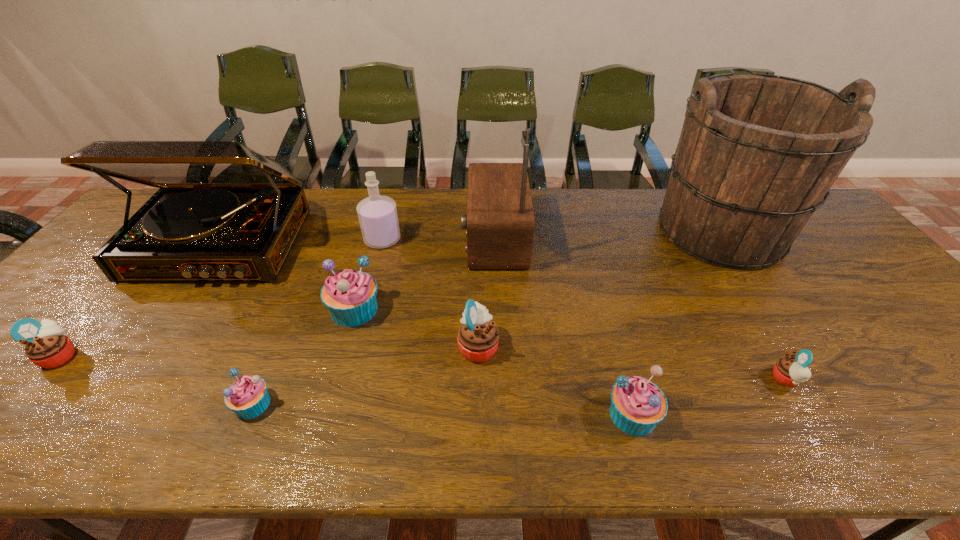
This screenshot has height=540, width=960. What are the coordinates of `the second smallest pink muffin` in the screenshot? It's located at pos(47,345).

The image size is (960, 540). Identify the location of the fifth muffin from left to right. (637, 405).

Where is `the third object from right to left`? the third object from right to left is located at coordinates click(x=637, y=405).

In order to click on the rightmost muffin in this screenshot , I will do `click(790, 371)`.

At what (x,y) coordinates should I click in order to perform the action: click on the smallest pink muffin. Please return your answer as a coordinate pair (x, y). Looking at the image, I should click on (790, 371).

Find the location of a particular element. This screenshot has height=540, width=960. the leftmost blue muffin is located at coordinates (248, 397).

Locate an element on the screen. the second muffin from left to right is located at coordinates (248, 397).

Identify the location of blank space located on the left of the bucket. (537, 228).

Locate an element on the screen. The image size is (960, 540). free location located 0.310m on the front-facing side of the radio receiver is located at coordinates (363, 238).

This screenshot has height=540, width=960. What are the coordinates of `free space located on the front-facing side of the radio receiver` in the screenshot? It's located at pos(434,238).